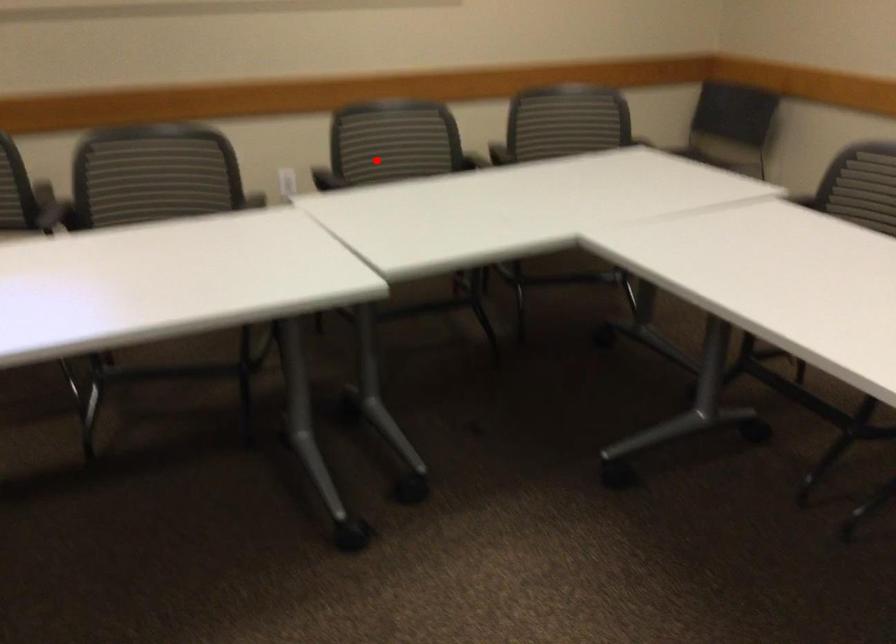
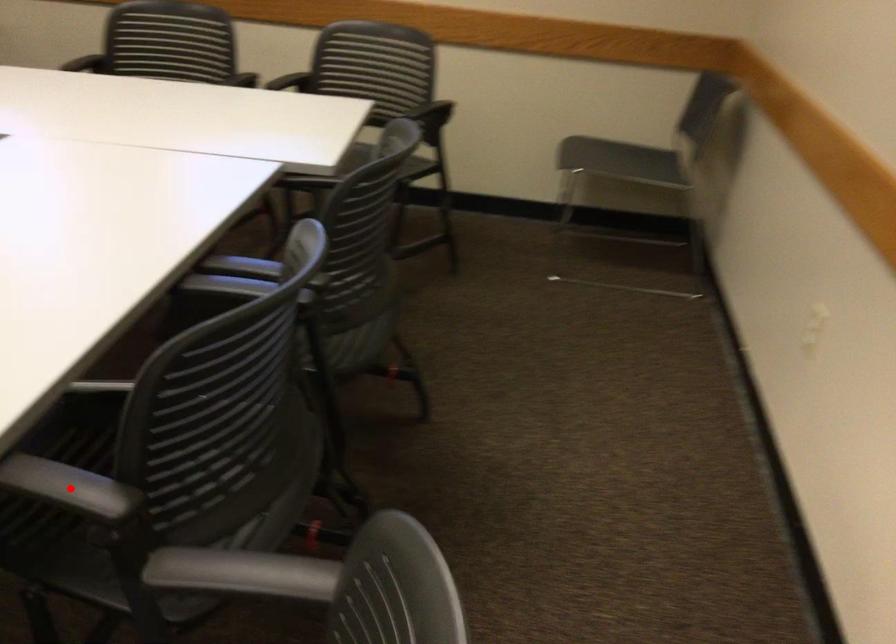
I am providing you with two images of the same scene from different viewpoints. A red point is marked on the first image and another point is marked on the second image. Are the points marked in image1 and image2 representing the same 3D position?

No